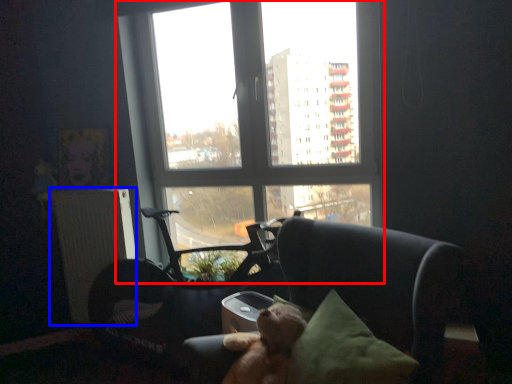
Question: Which object is further to the camera taking this photo, window (highlighted by a red box) or radiator (highlighted by a blue box)?

Choices:
 (A) window
 (B) radiator

Answer: (B)